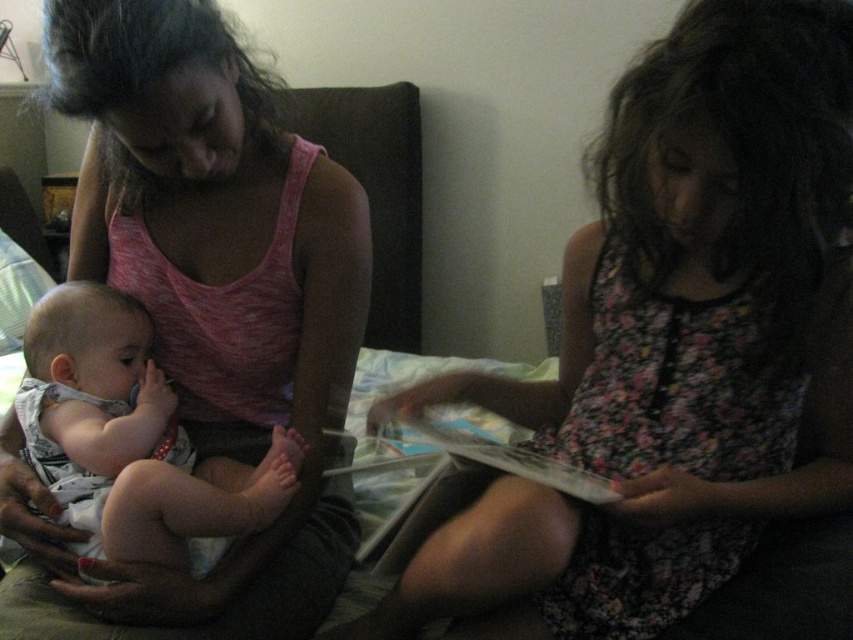
Where is the floral dress at center located in the image?

The floral dress at center is located at point (x=672, y=344) in the image.

You are a photographer trying to capture a closeup of the baby in the image. You need to focus on the white cotton onesie at left. Since the pink heather tank top at upper left is in the way, can you adjust your camera angle to the left to avoid it?

→ The pink heather tank top at upper left is positioned on the right side of white cotton onesie at left, so adjusting the camera angle to the left would move the focus away from the onesie and towards the tank top. Instead, moving the camera angle slightly to the right would position the onesie away from the tank top.

Based on the photo, you are a parent trying to choose between the floral dress at center and the white cotton onesie at left for your child. Based on the size, which one would you pick if you want something that fits a newborn?

The white cotton onesie at left is smaller in size, so it would be more appropriate for a newborn compared to the floral dress at center which is larger.